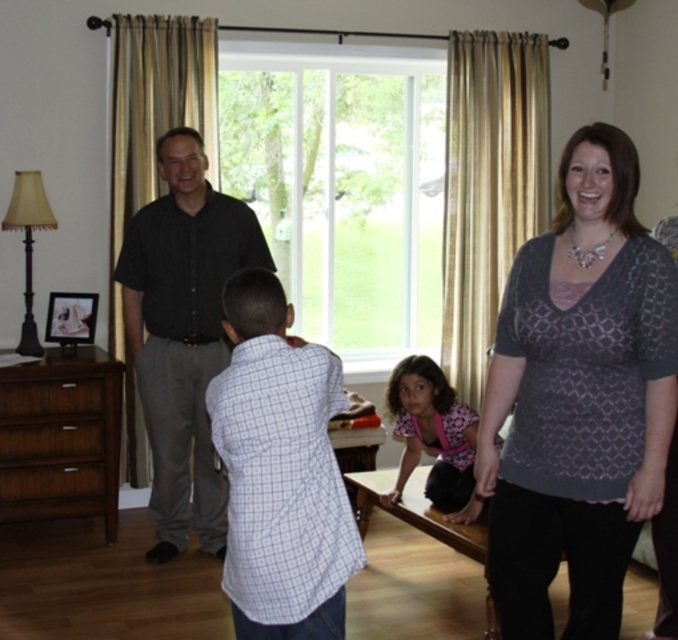
Question: Which object appears farthest from the camera in this image?

Choices:
 (A) brown wood dresser at lower left
 (B) patterned fabric blouse at center
 (C) patterned gray blouse at right

Answer: (A)

Question: Does patterned gray blouse at right have a larger size compared to black smooth shirt at center?

Choices:
 (A) no
 (B) yes

Answer: (A)

Question: Is the position of patterned gray blouse at right less distant than that of patterned fabric blouse at center?

Choices:
 (A) yes
 (B) no

Answer: (A)

Question: In this image, where is brown wood dresser at lower left located relative to pink fabric shirt at lower center?

Choices:
 (A) below
 (B) above

Answer: (A)

Question: Which of the following is the farthest from the observer?

Choices:
 (A) (658, 480)
 (B) (52, 426)
 (C) (159, 456)

Answer: (B)

Question: Which of the following is the closest to the observer?

Choices:
 (A) pink fabric shirt at lower center
 (B) brown wood dresser at lower left

Answer: (A)